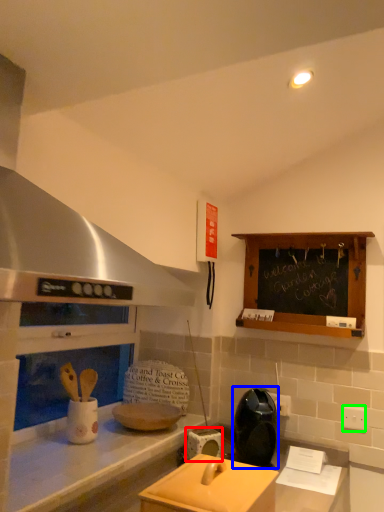
Question: Which object is the farthest from appliance (highlighted by a red box)? Choose among these: appliance (highlighted by a blue box) or electric outlet (highlighted by a green box).

Choices:
 (A) appliance
 (B) electric outlet

Answer: (B)